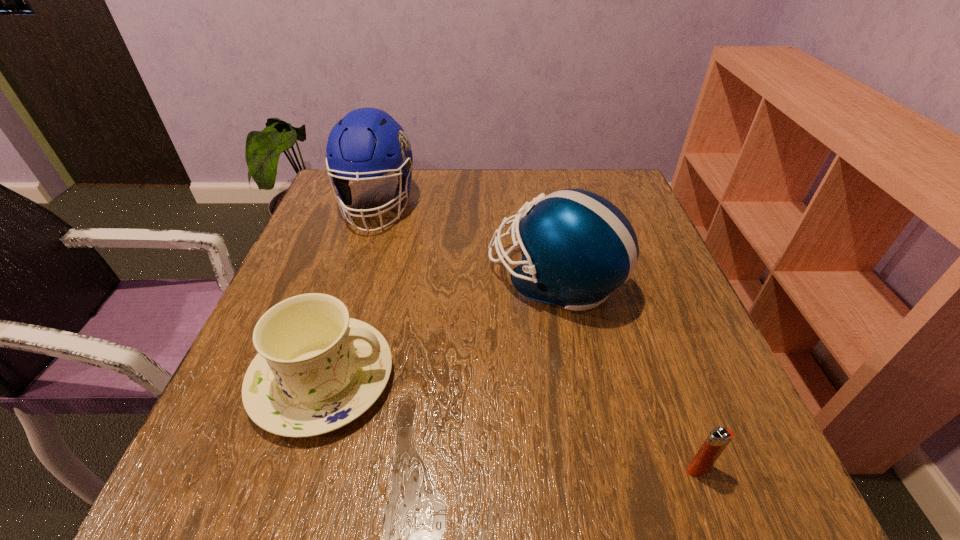
Locate an element on the screen. The width and height of the screenshot is (960, 540). the farthest object is located at coordinates (367, 143).

I want to click on the left football helmet, so click(367, 143).

This screenshot has height=540, width=960. In order to click on the third nearest object in this screenshot , I will do `click(577, 247)`.

Locate an element on the screen. the nearer football helmet is located at coordinates point(577,247).

Identify the location of the second nearest object. (317, 370).

Find the location of `chinaware`. chinaware is located at coordinates (317, 370).

Locate an element on the screen. The height and width of the screenshot is (540, 960). the shortest object is located at coordinates click(718, 439).

The width and height of the screenshot is (960, 540). I want to click on the rightmost object, so click(x=718, y=439).

Locate an element on the screen. The image size is (960, 540). free space located on the front-facing side of the farthest object is located at coordinates (321, 384).

In order to click on vacant position located 0.180m at the front of the nearer football helmet with the faceguard in this screenshot , I will do `click(402, 279)`.